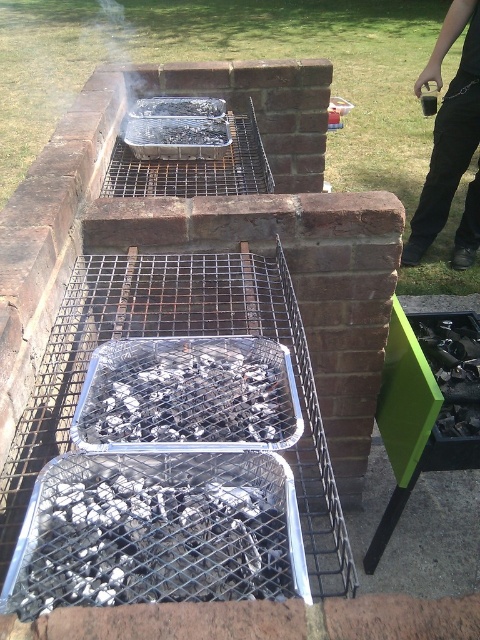
Question: Which object is the farthest from the charcoal ash at center?

Choices:
 (A) charcoal briquettes at center
 (B) black pants at right
 (C) charcoal ash at lower center

Answer: (B)

Question: From the image, what is the correct spatial relationship of charcoal ash at center in relation to charcoal briquettes at center?

Choices:
 (A) below
 (B) above

Answer: (A)

Question: Which point appears closest to the camera in this image?

Choices:
 (A) (191, 140)
 (B) (192, 417)

Answer: (B)

Question: Can you confirm if charcoal ash at lower center is positioned to the left of charcoal ash at center?

Choices:
 (A) yes
 (B) no

Answer: (A)

Question: Which point appears closest to the camera in this image?

Choices:
 (A) pyautogui.click(x=418, y=244)
 (B) pyautogui.click(x=164, y=371)
 (C) pyautogui.click(x=290, y=570)
 (D) pyautogui.click(x=142, y=132)

Answer: (C)

Question: Is black pants at right positioned behind charcoal briquettes at center?

Choices:
 (A) yes
 (B) no

Answer: (A)